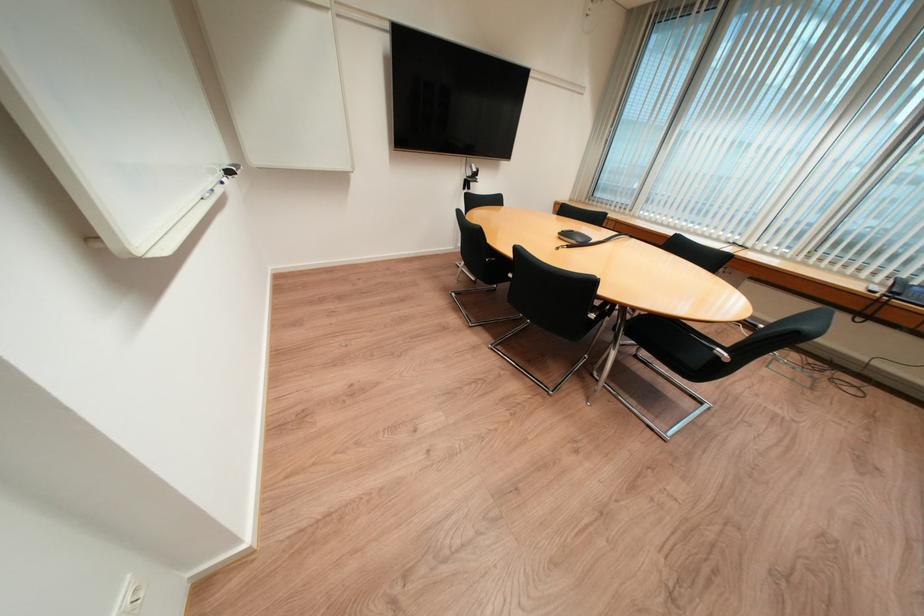
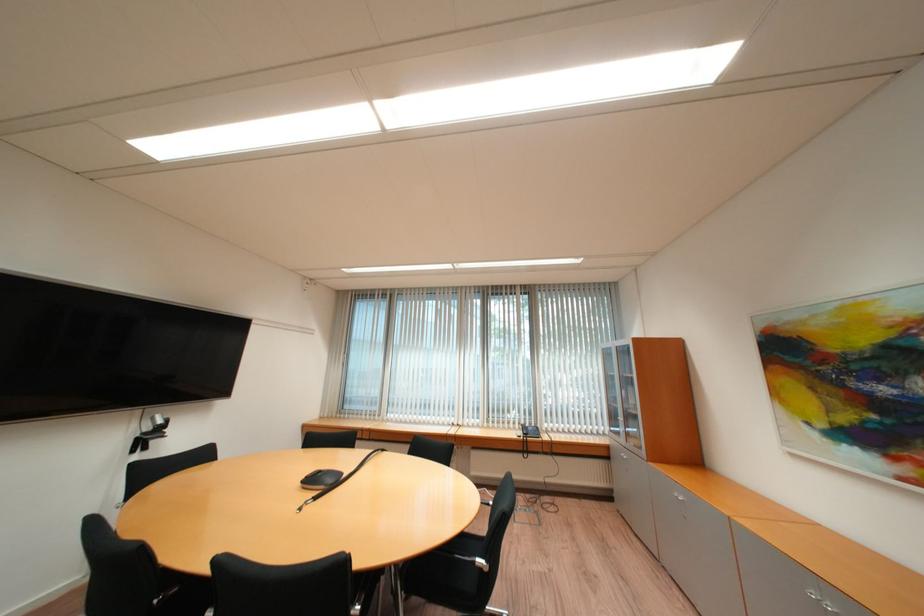
The point at (480,168) is marked in the first image. Where is the corresponding point in the second image?

(162, 419)